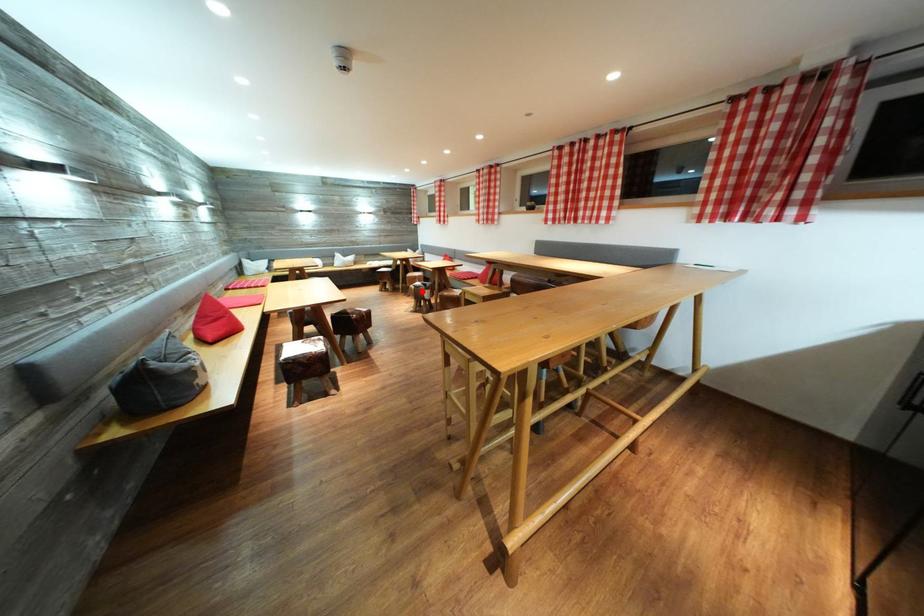
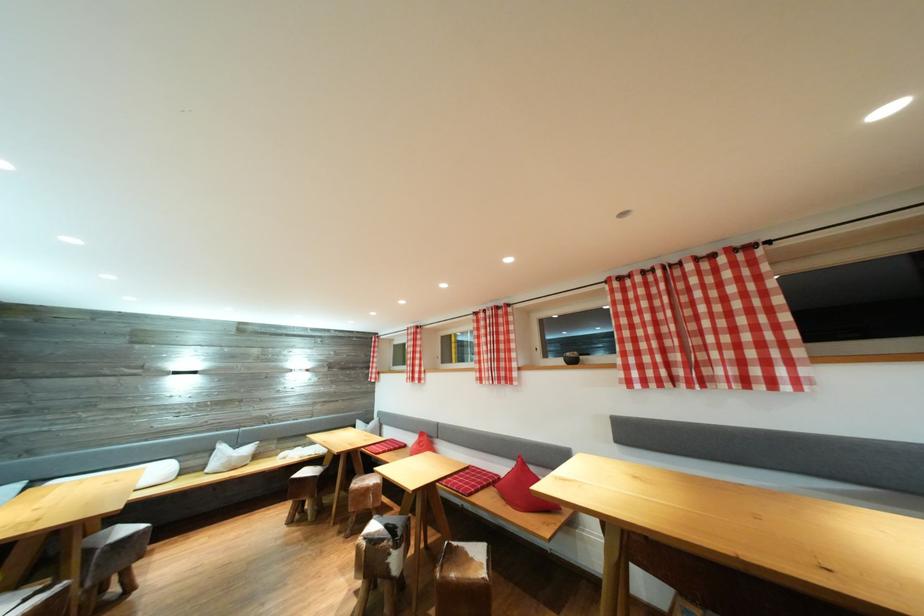
Locate, in the second image, the point that corresponds to the highlighted location in the first image.

(377, 546)